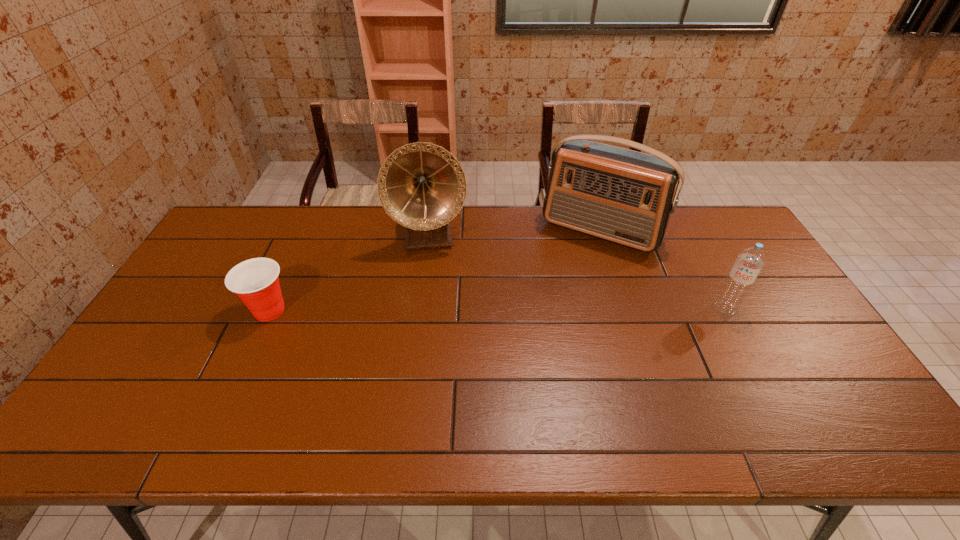
This screenshot has width=960, height=540. Identify the location of free space located on the horn of the third object from right to left. pos(438,326).

Where is `free space located 0.400m on the front-facing side of the radio receiver`? This screenshot has height=540, width=960. free space located 0.400m on the front-facing side of the radio receiver is located at coordinates (530, 341).

Identify the location of vacant space located on the front-facing side of the radio receiver. (567, 275).

Where is `free space located on the front-facing side of the radio receiver`? The width and height of the screenshot is (960, 540). free space located on the front-facing side of the radio receiver is located at coordinates (573, 265).

Identify the location of phonograph record situated at the far edge. The height and width of the screenshot is (540, 960). (422, 186).

Find the location of a particular element. The height and width of the screenshot is (540, 960). radio receiver present at the far edge is located at coordinates (620, 195).

Identify the location of free space at the far edge. Image resolution: width=960 pixels, height=540 pixels. (348, 235).

Image resolution: width=960 pixels, height=540 pixels. In the image, there is a desktop. Find the location of `free space at the near edge`. free space at the near edge is located at coordinates click(x=225, y=389).

Locate an element on the screen. This screenshot has width=960, height=540. free location at the left edge is located at coordinates (185, 328).

Where is `vacant space at the right edge of the desktop`? This screenshot has width=960, height=540. vacant space at the right edge of the desktop is located at coordinates (832, 361).